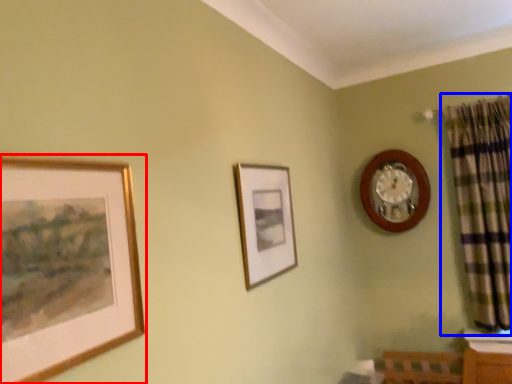
Question: Which object appears closest to the camera in this image, picture frame (highlighted by a red box) or curtain (highlighted by a blue box)?

Choices:
 (A) picture frame
 (B) curtain

Answer: (A)